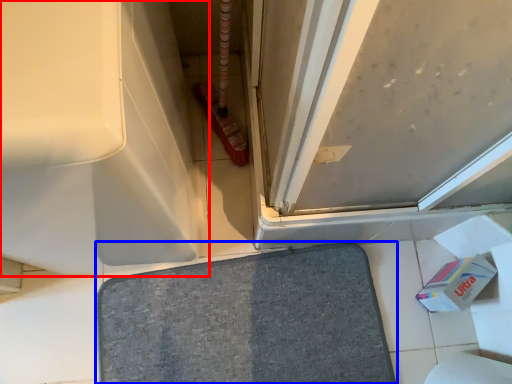
Question: Which object is closer to the camera taking this photo, bath (highlighted by a red box) or bath mat (highlighted by a blue box)?

Choices:
 (A) bath
 (B) bath mat

Answer: (A)